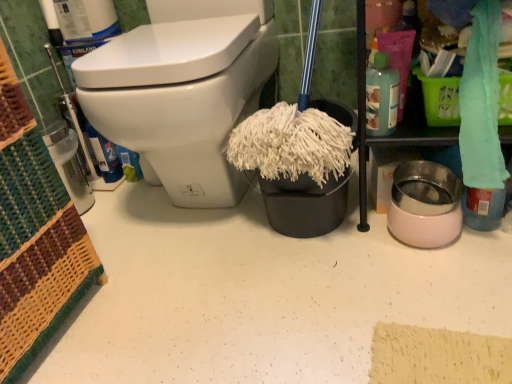
Where is `vacant region in front of white glossy toilet at upper left`? The width and height of the screenshot is (512, 384). vacant region in front of white glossy toilet at upper left is located at coordinates (244, 299).